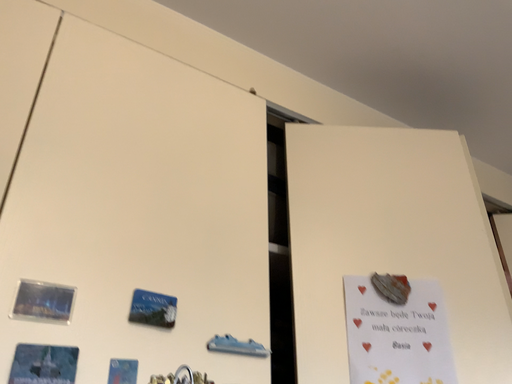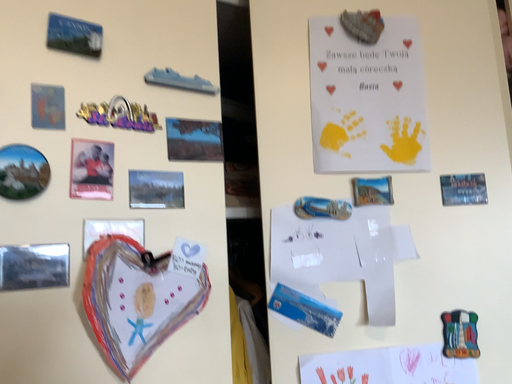
Question: How did the camera likely rotate when shooting the video?

Choices:
 (A) rotated upward
 (B) rotated downward

Answer: (B)